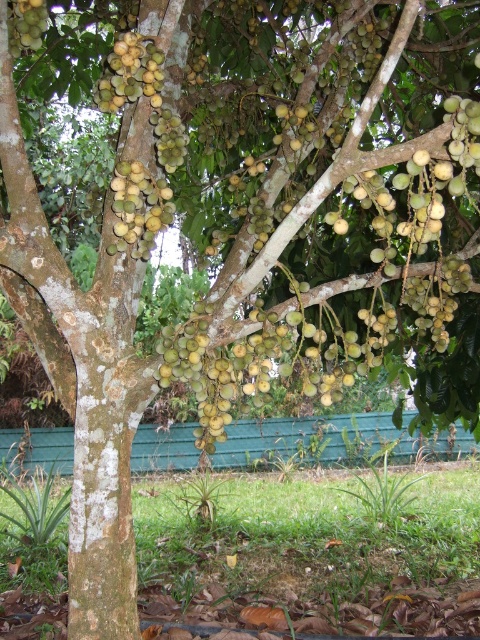
Can you confirm if green matte fruit at center is wider than green matte fruit at upper left?

No, green matte fruit at center is not wider than green matte fruit at upper left.

Does green matte fruit at center appear on the right side of green matte fruit at upper left?

Correct, you'll find green matte fruit at center to the right of green matte fruit at upper left.

Which is in front, point (140, 237) or point (24, 13)?

Point (24, 13) is in front.

This screenshot has height=640, width=480. What are the coordinates of `green matte fruit at center` in the screenshot? It's located at (139, 209).